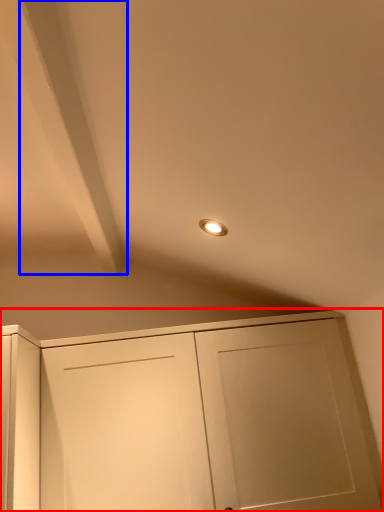
Question: Which object appears farthest to the camera in this image, cupboard (highlighted by a red box) or exhaust hood (highlighted by a blue box)?

Choices:
 (A) cupboard
 (B) exhaust hood

Answer: (A)